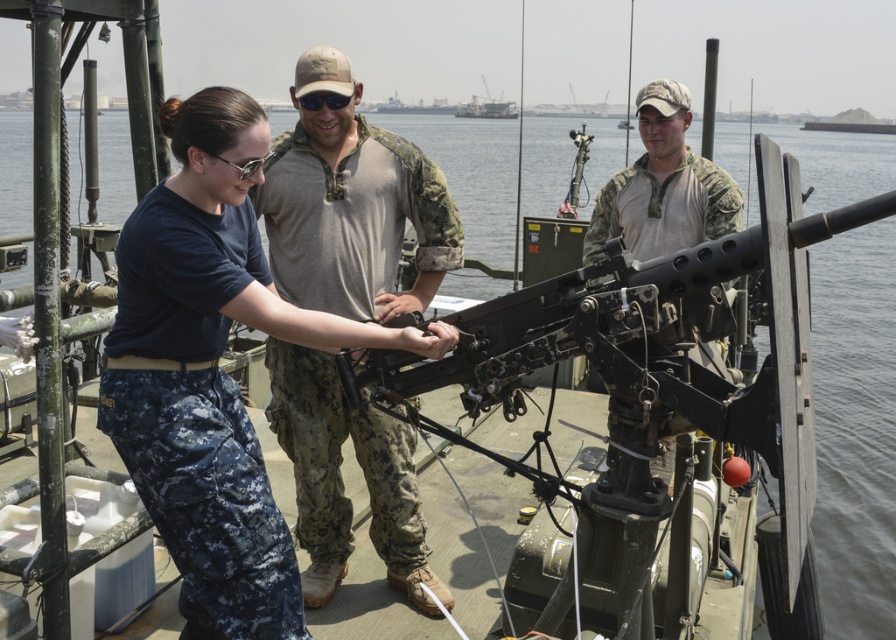
Who is more distant from viewer, [148,353] or [487,113]?

Point [487,113]

This screenshot has height=640, width=896. Describe the element at coordinates (211, 371) in the screenshot. I see `blue camouflage pants at center` at that location.

This screenshot has height=640, width=896. Identify the location of blue camouflage pants at center. (211, 371).

Find the location of a particular element. blue camouflage pants at center is located at coordinates click(x=211, y=371).